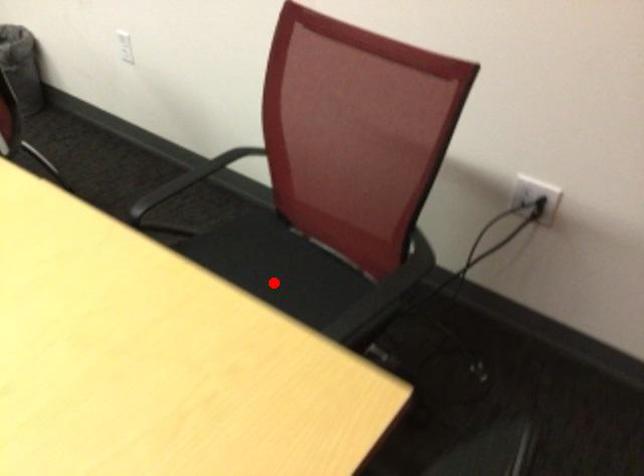
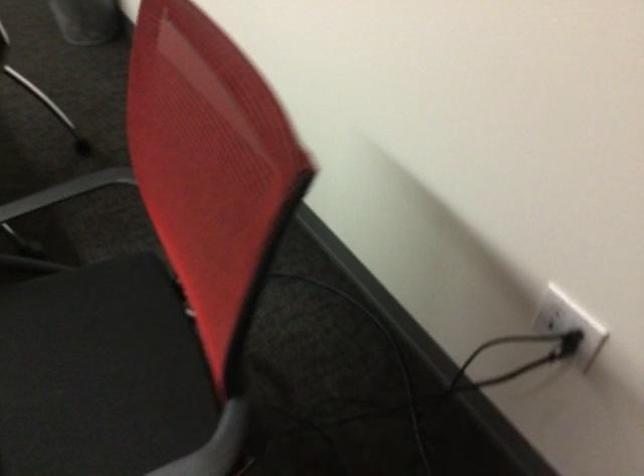
Question: I am providing you with two images of the same scene from different viewpoints. Given a red point in image1, look at the same physical point in image2. Is it:

Choices:
 (A) Closer to the viewpoint
 (B) Farther from the viewpoint

Answer: (A)